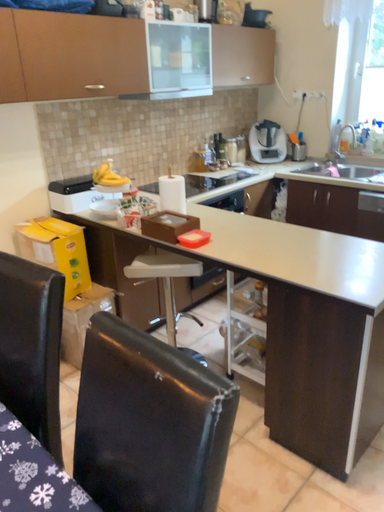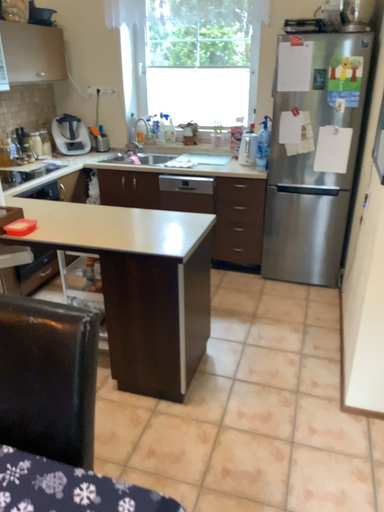
Question: Which way did the camera rotate in the video?

Choices:
 (A) rotated right
 (B) rotated left

Answer: (A)